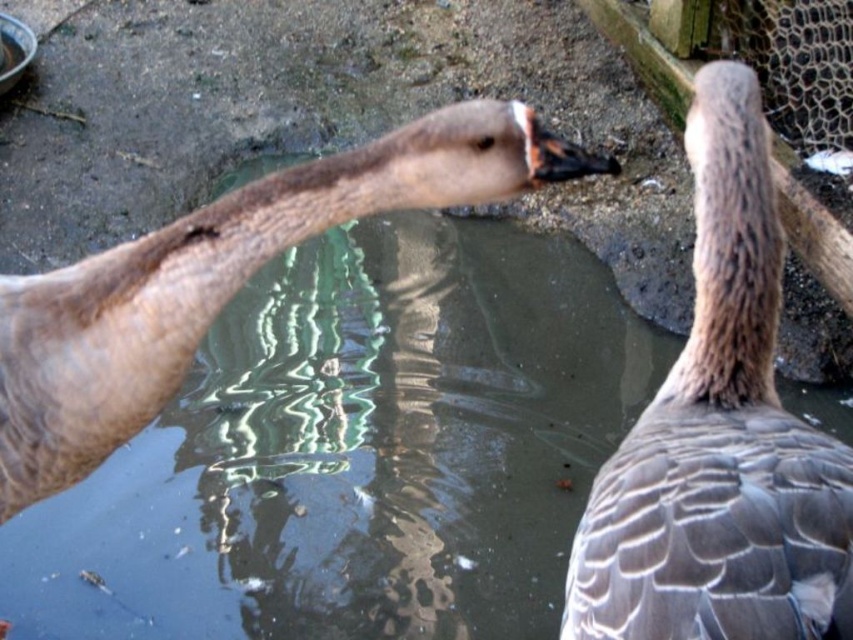
Is gray feathered duck at center shorter than brown feathered duck at left?

No, gray feathered duck at center is not shorter than brown feathered duck at left.

Where is `gray feathered duck at center`? The width and height of the screenshot is (853, 640). gray feathered duck at center is located at coordinates (718, 436).